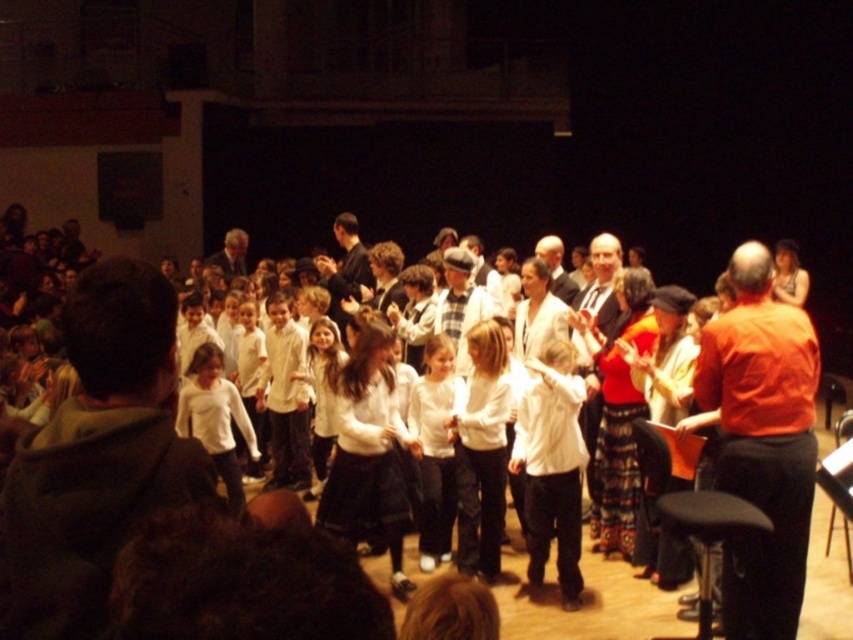
Who is higher up, white hoodie at left or plaid fabric hat at center?

plaid fabric hat at center is higher up.

Describe the element at coordinates (97, 454) in the screenshot. This screenshot has width=853, height=640. I see `white hoodie at left` at that location.

Locate an element on the screen. The width and height of the screenshot is (853, 640). white hoodie at left is located at coordinates (97, 454).

Is shiny gold necklace at upper center to the right of white shirt at center from the viewer's perspective?

Yes, shiny gold necklace at upper center is to the right of white shirt at center.

Image resolution: width=853 pixels, height=640 pixels. I want to click on shiny gold necklace at upper center, so click(788, 275).

Locate an element on the screen. The width and height of the screenshot is (853, 640). shiny gold necklace at upper center is located at coordinates (x=788, y=275).

At what (x,y) coordinates should I click in order to perform the action: click on shiny gold necklace at upper center. Please return your answer as a coordinate pair (x, y). This screenshot has height=640, width=853. Looking at the image, I should click on (788, 275).

Is white textured sweater at center smaller than white shirt at center?

No.

Who is lower down, white textured sweater at center or white shirt at center?

Positioned lower is white textured sweater at center.

Between point (607, 314) and point (546, 246), which one is positioned behind?

Positioned behind is point (546, 246).

Where is `white textured sweater at center`? white textured sweater at center is located at coordinates (601, 284).